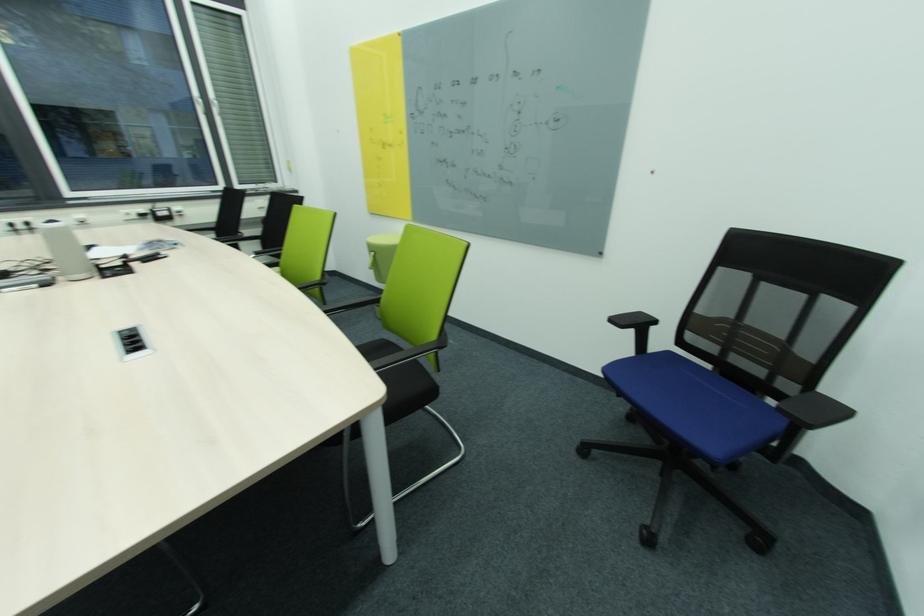
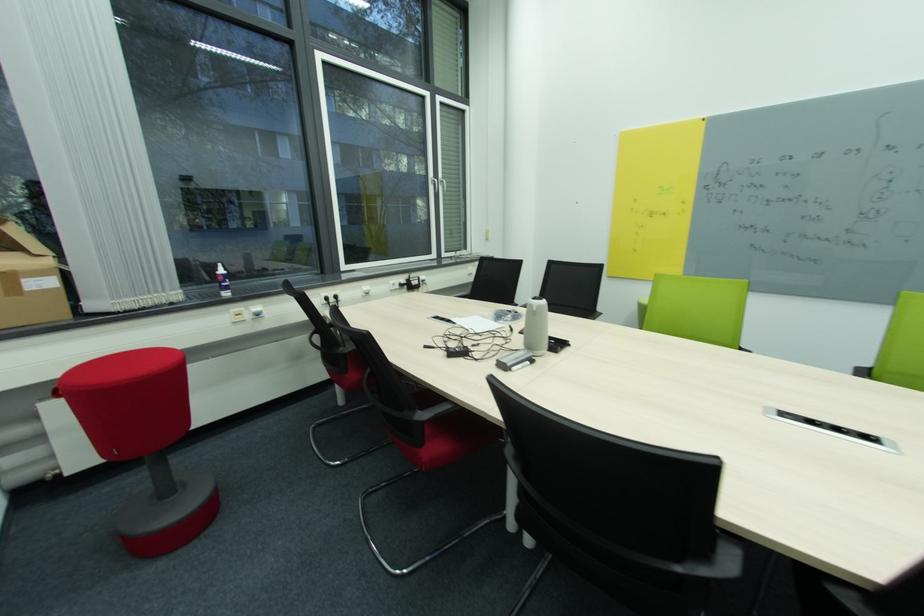
Question: Which direction would the cameraman need to move to produce the second image? Reply with the corresponding letter.

Choices:
 (A) Left
 (B) Right
 (C) Forward
 (D) Backward

Answer: (A)